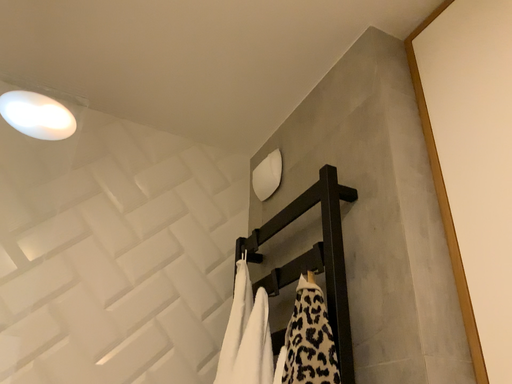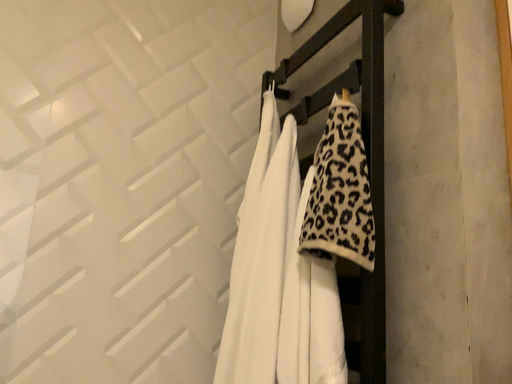
Question: Which way did the camera rotate in the video?

Choices:
 (A) rotated upward
 (B) rotated downward

Answer: (B)